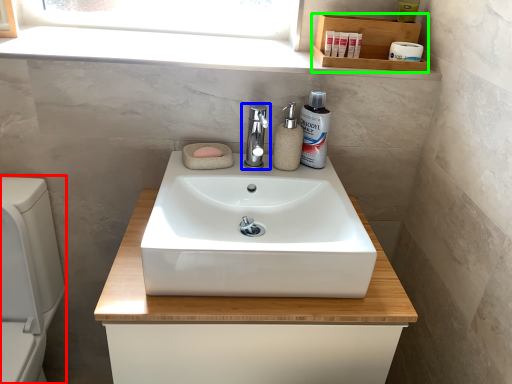
Question: Considering the real-world distances, which object is closest to appliance (highlighted by a red box)? tap (highlighted by a blue box) or shelf (highlighted by a green box).

Choices:
 (A) tap
 (B) shelf

Answer: (A)